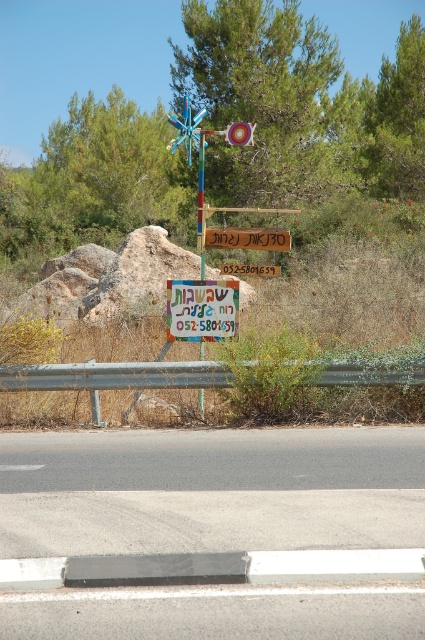
Does point (127, 314) lie in front of point (198, 326)?

No.

Is rough textured rock at center above matte plastic sign at center?

Yes, rough textured rock at center is above matte plastic sign at center.

Between point (127, 296) and point (223, 333), which one is positioned behind?

Point (127, 296)

Identify the location of rough textured rock at center. The width and height of the screenshot is (425, 640). (110, 280).

Who is more distant from viewer, (240, 481) or (189, 289)?

The point (189, 289) is behind.

Who is higher up, gray asphalt road at center or matte plastic sign at center?

matte plastic sign at center is higher up.

Which is behind, point (98, 442) or point (172, 292)?

The point (172, 292) is behind.

Identify the location of gray asphalt road at center. (215, 529).

Can you confirm if metallic pole at center is positioned above brown wooden sign at center?

Yes.

Who is lower down, metallic pole at center or brown wooden sign at center?

Positioned lower is brown wooden sign at center.

Is point (201, 138) more distant than point (274, 266)?

No, it is not.

The image size is (425, 640). I want to click on metallic pole at center, so click(x=201, y=202).